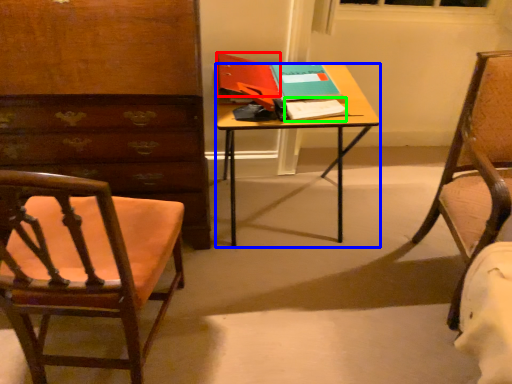
Question: Which object is positioned closest to book (highlighted by a red box)? Select from desk (highlighted by a blue box) and notepad (highlighted by a green box).

Choices:
 (A) desk
 (B) notepad

Answer: (A)